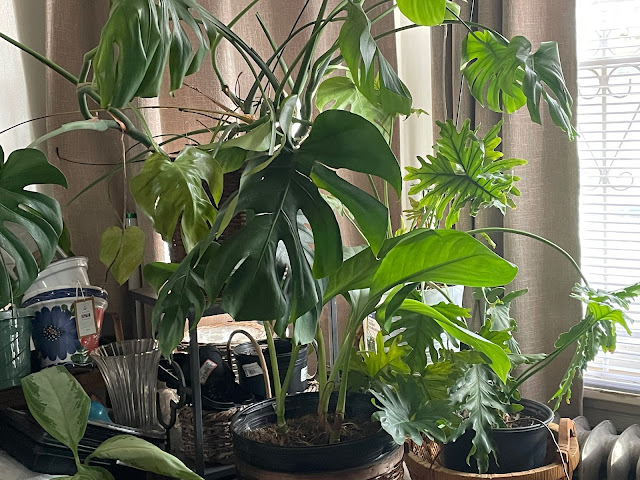
Image resolution: width=640 pixels, height=480 pixels. Find the location of `wood pots`. wood pots is located at coordinates (390, 467), (445, 474), (211, 438).